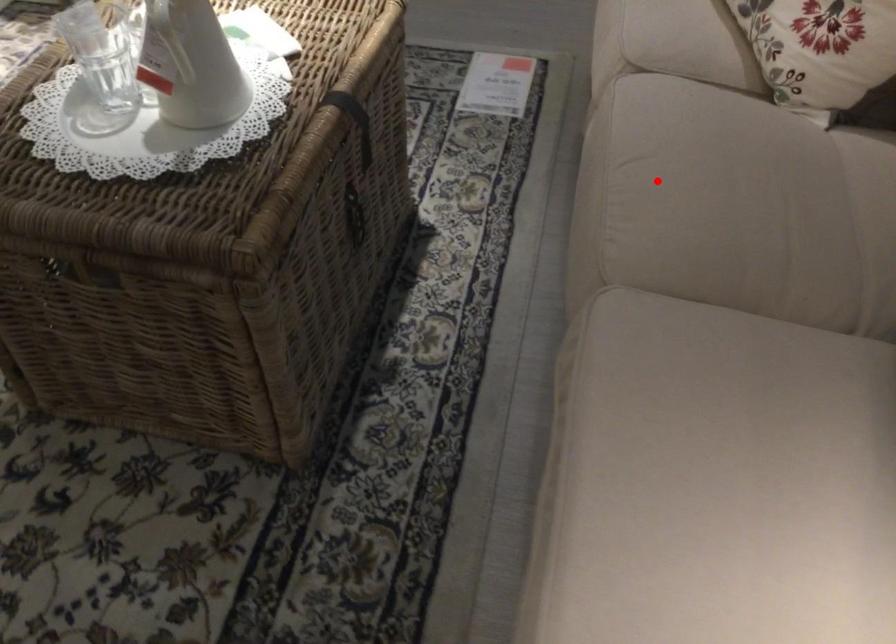
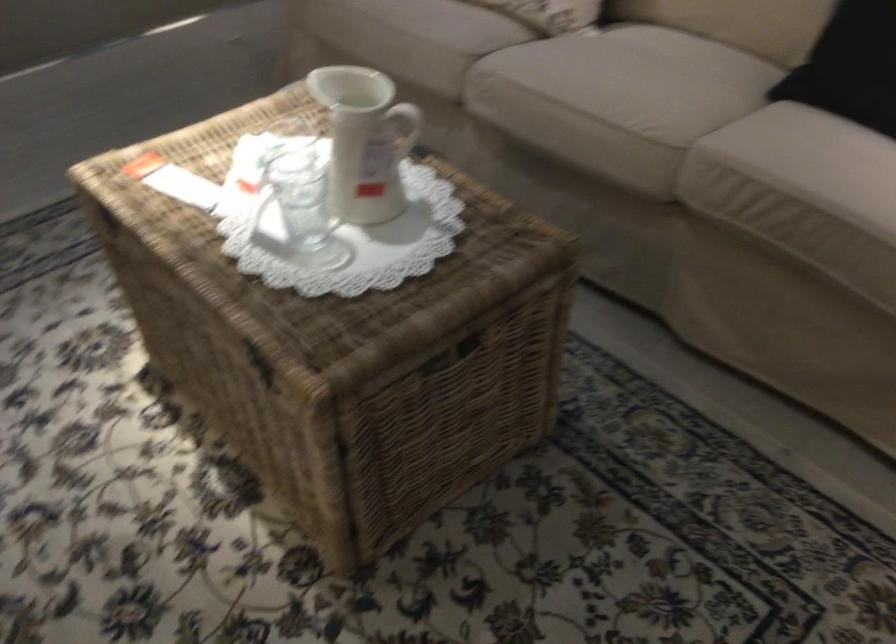
In the second image, find the point that corresponds to the highlighted location in the first image.

(617, 93)